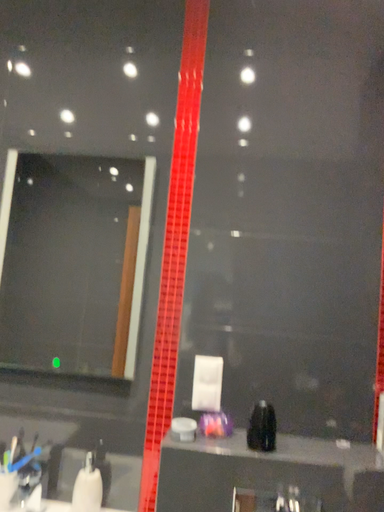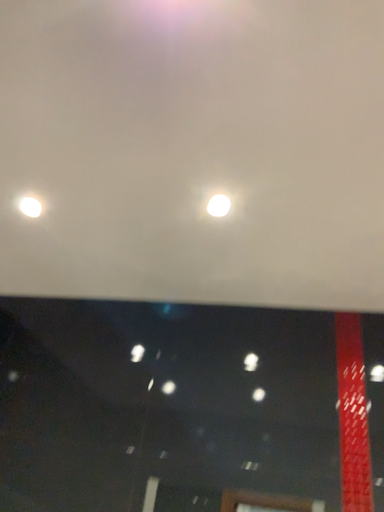
Question: Which way did the camera rotate in the video?

Choices:
 (A) rotated upward
 (B) rotated downward

Answer: (A)